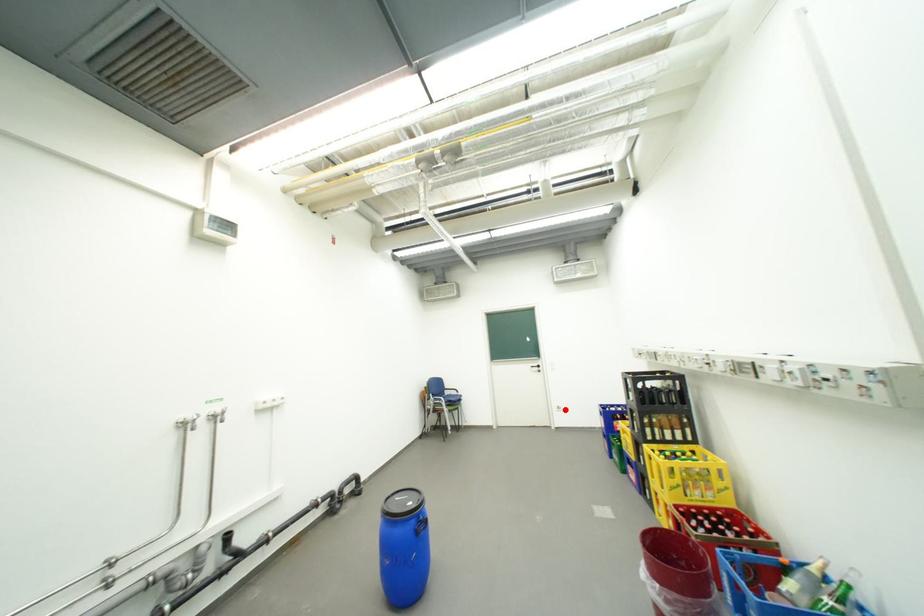
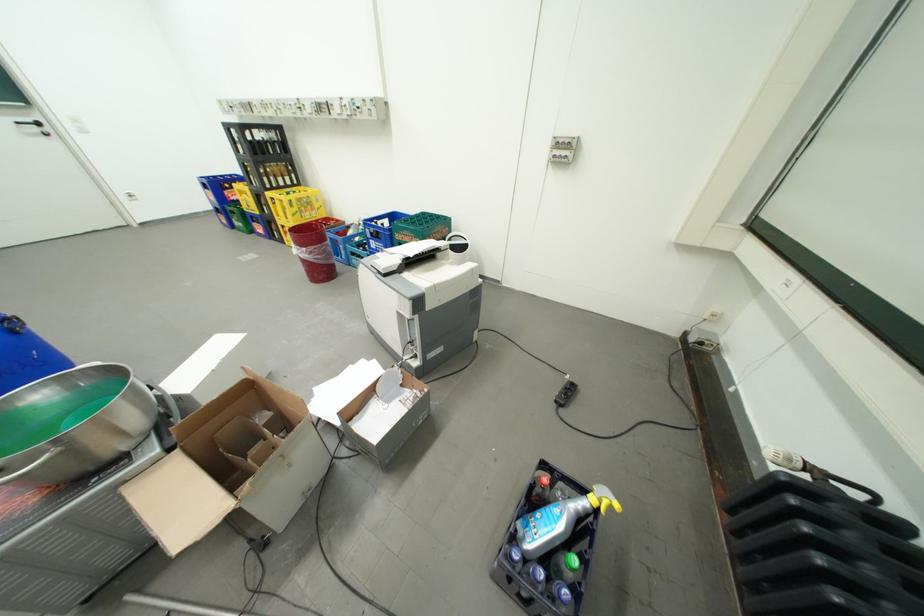
Question: I am providing you with two images of the same scene from different viewpoints. Given a red point in image1, look at the same physical point in image2. Is it:

Choices:
 (A) Closer to the viewpoint
 (B) Farther from the viewpoint

Answer: (A)